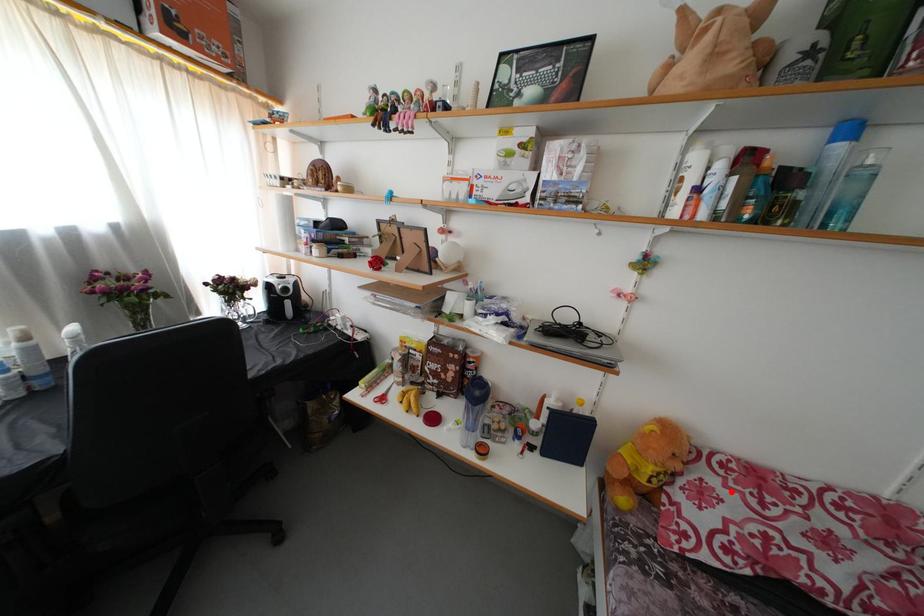
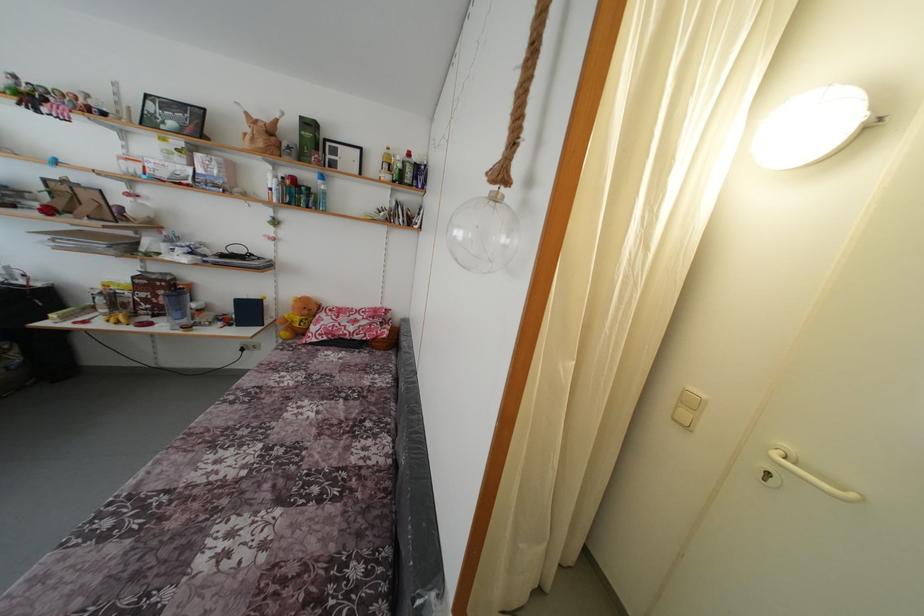
Find the pixel in the second image that matches the highlighted location in the first image.

(332, 321)